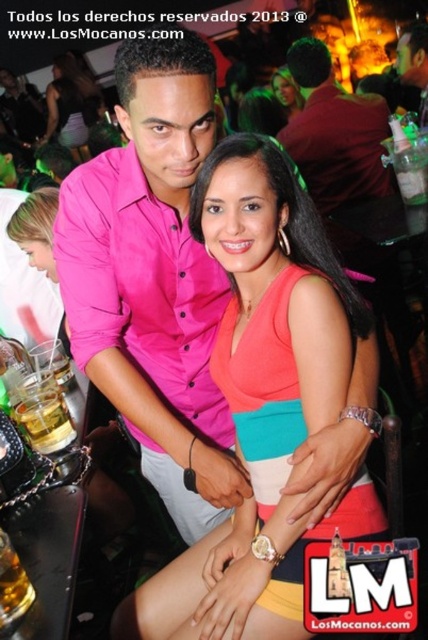
You are a photographer at a party and want to take a photo of the pink fabric dress at center and the matte black dress at center. Which dress is closer to the camera?

The pink fabric dress at center is positioned under the matte black dress at center, so the matte black dress at center is closer to the camera.

You are organizing a fashion show and need to arrange two dresses on a runway. The pink fabric dress at center and the matte black dress at center are to be displayed side by side. Based on their widths, which dress should be placed on the left to ensure the narrower one is positioned first for the audience?

The pink fabric dress at center should be placed on the left since it has a lesser width compared to the matte black dress at center, making it the narrower option to be displayed first.